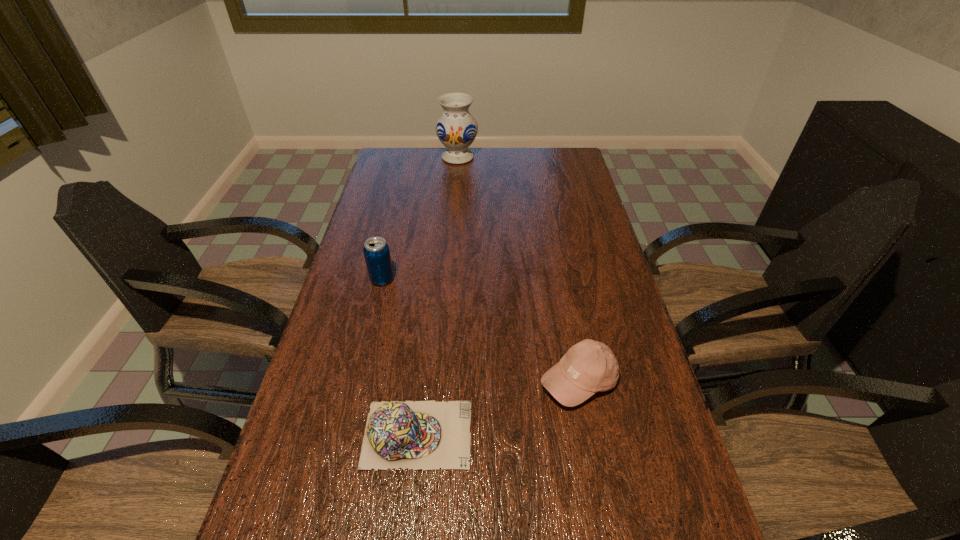
You are a GUI agent. You are given a task and a screenshot of the screen. Output one action in this format:
    pyautogui.click(x=<x>, y=<y>)
    Task: Click on the vacant space located 0.330m on the front, side, and top of the shortest object
    The width and height of the screenshot is (960, 540).
    Given the screenshot: What is the action you would take?
    pyautogui.click(x=624, y=434)

Locate an element on the screen. The height and width of the screenshot is (540, 960). object that is positioned at the far edge is located at coordinates (456, 128).

Locate an element on the screen. pop soda at the left edge is located at coordinates (376, 251).

You are a GUI agent. You are given a task and a screenshot of the screen. Output one action in this format:
    pyautogui.click(x=<x>, y=<y>)
    Task: Click on the cap located at the left edge
    This screenshot has height=540, width=960.
    Given the screenshot: What is the action you would take?
    pyautogui.click(x=427, y=435)

Where is `object situated at the right edge`? object situated at the right edge is located at coordinates (589, 366).

Image resolution: width=960 pixels, height=540 pixels. I want to click on free space at the far edge of the desktop, so click(x=446, y=175).

Identify the location of vacant area at the left edge. (394, 184).

The height and width of the screenshot is (540, 960). Find the location of `free space at the right edge`. free space at the right edge is located at coordinates (590, 280).

Locate an element on the screen. The image size is (960, 540). vacant area at the far left corner is located at coordinates (416, 155).

In the image, there is a desktop. What are the coordinates of `free space at the far right corner` in the screenshot? It's located at (560, 153).